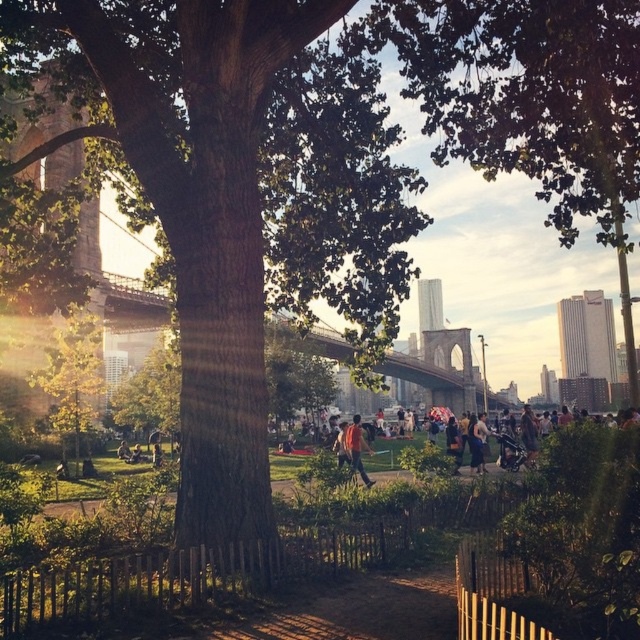
Can you confirm if yellow-green leaves at center is positioned to the right of orange fabric jacket at center?

In fact, yellow-green leaves at center is to the left of orange fabric jacket at center.

Can you confirm if yellow-green leaves at center is positioned to the left of orange fabric jacket at center?

Indeed, yellow-green leaves at center is positioned on the left side of orange fabric jacket at center.

Which is behind, point (60, 392) or point (355, 420)?

The point (60, 392) is behind.

Identify the location of yellow-green leaves at center. This screenshot has width=640, height=640. (72, 380).

Consider the image. Can you confirm if yellow-green leaves at center is taller than green leafy tree at center?

In fact, yellow-green leaves at center may be shorter than green leafy tree at center.

Does yellow-green leaves at center appear under green leafy tree at center?

Actually, yellow-green leaves at center is above green leafy tree at center.

This screenshot has width=640, height=640. Find the location of `yellow-green leaves at center`. yellow-green leaves at center is located at coordinates (x=72, y=380).

Between green grass at center and green leafy tree at center, which one has more height?

green leafy tree at center

Who is higher up, green grass at center or green leafy tree at center?

green grass at center

Does point (285, 540) come closer to viewer compared to point (168, 340)?

Yes, it is in front of point (168, 340).

Locate an element on the screen. Image resolution: width=640 pixels, height=640 pixels. green grass at center is located at coordinates (387, 552).